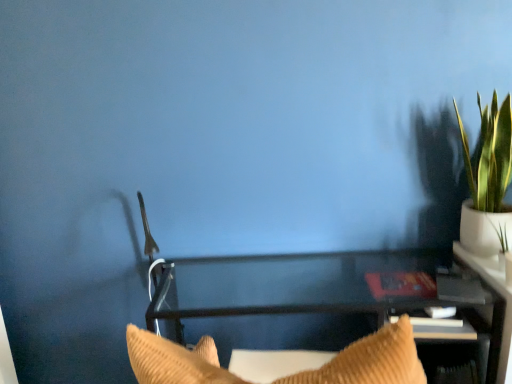
Question: Is point (202, 306) closer or farther from the camera than point (497, 249)?

Choices:
 (A) closer
 (B) farther

Answer: (B)

Question: Looking at the image, does clear glass table at center seem bigger or smaller compared to green leafy plant in white pot at upper right?

Choices:
 (A) big
 (B) small

Answer: (A)

Question: From a real-world perspective, relative to green leafy plant in white pot at upper right, is clear glass table at center vertically above or below?

Choices:
 (A) above
 (B) below

Answer: (B)

Question: Is green leafy plant in white pot at upper right bigger or smaller than clear glass table at center?

Choices:
 (A) small
 (B) big

Answer: (A)

Question: In terms of height, does green leafy plant in white pot at upper right look taller or shorter compared to clear glass table at center?

Choices:
 (A) short
 (B) tall

Answer: (B)

Question: Do you think green leafy plant in white pot at upper right is within clear glass table at center, or outside of it?

Choices:
 (A) inside
 (B) outside

Answer: (B)

Question: Does point (495, 178) appear closer or farther from the camera than point (301, 291)?

Choices:
 (A) farther
 (B) closer

Answer: (B)